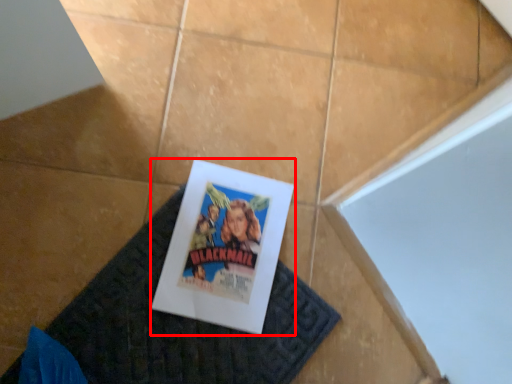
Question: Where is poster (annotated by the red box) located in relation to doormat in the image?

Choices:
 (A) left
 (B) right

Answer: (B)